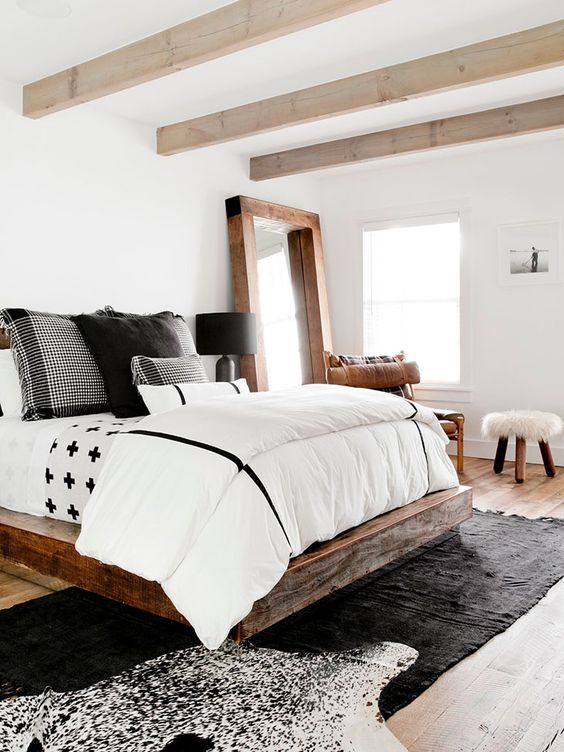
Where is `wood trim`? Image resolution: width=564 pixels, height=752 pixels. wood trim is located at coordinates (113, 581).